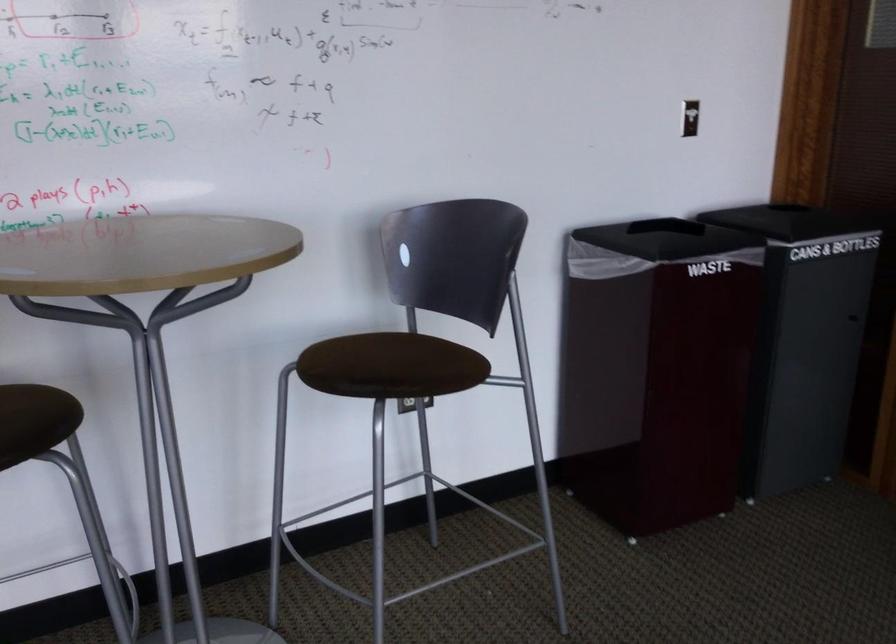
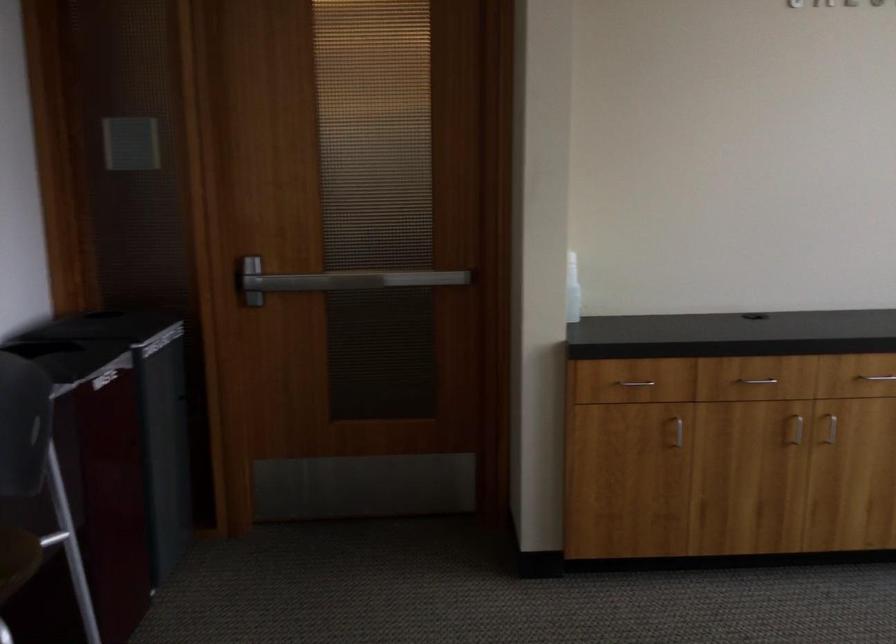
Question: Based on the continuous images, in which direction is the camera rotating? Reply with the corresponding letter.

Choices:
 (A) Left
 (B) Right
 (C) Up
 (D) Down

Answer: (B)